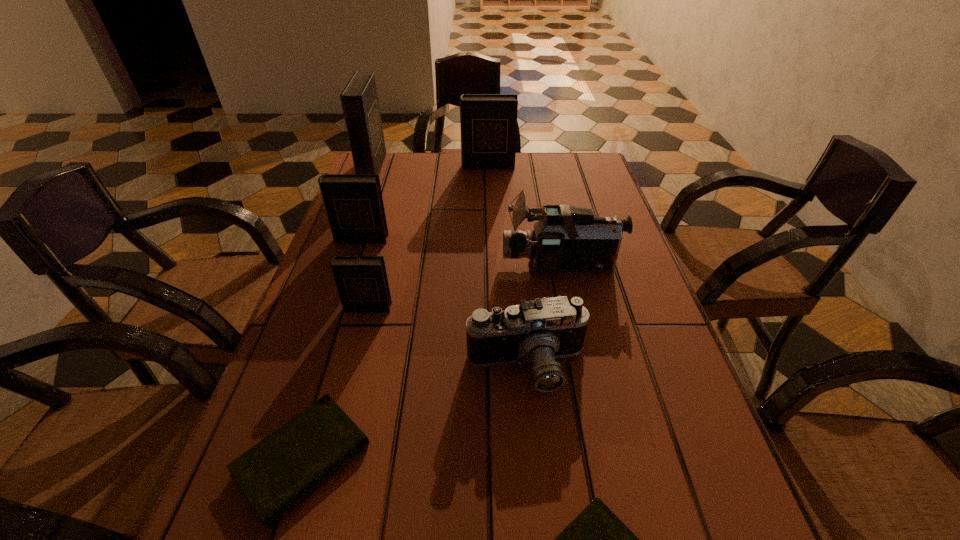
This screenshot has width=960, height=540. In order to click on the tallest object in this screenshot , I will do `click(359, 99)`.

What are the coordinates of `the biggest dark diary` in the screenshot? It's located at (359, 99).

Locate an element on the screen. the seventh shortest object is located at coordinates (488, 122).

Find the location of a particular element. The height and width of the screenshot is (540, 960). the second biggest dark diary is located at coordinates (488, 122).

This screenshot has width=960, height=540. Find the location of `camcorder`. camcorder is located at coordinates (565, 238).

Locate an element on the screen. The height and width of the screenshot is (540, 960). the third biggest dark diary is located at coordinates (354, 205).

This screenshot has height=540, width=960. In order to click on the third farthest object in this screenshot , I will do (x=354, y=205).

Image resolution: width=960 pixels, height=540 pixels. Identify the location of the nearest dark diary. point(362,283).

At what (x,y) coordinates should I click in order to perform the action: click on the fifth farthest object. Please return your answer as a coordinate pair (x, y). Looking at the image, I should click on (362, 283).

At what (x,y) coordinates should I click in order to perform the action: click on camera. Please return your answer as a coordinate pair (x, y). The width and height of the screenshot is (960, 540). Looking at the image, I should click on (539, 331).